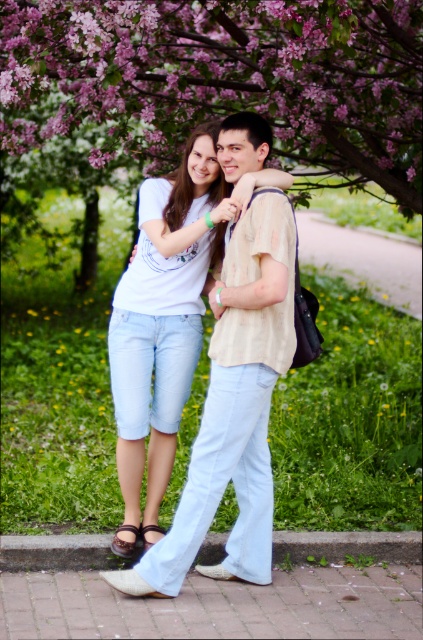
You are standing at the center of the image and want to place a small flag at the point that is behind the other point. Which coordinate should you choose between point (178, 550) and point (98, 620)?

Point (178, 550) is behind point (98, 620), so you should place the flag at point (178, 550).

You are a photographer trying to capture the two friends in the scene. The pink blossoms at upper center are crucial for the composition. If you want to ensure the blossoms are centered in the frame, where should you position your camera relative to the current viewpoint?

To center the pink blossoms at upper center in the frame, position your camera at point (x=225, y=76), as that is the exact coordinate of the blossoms.